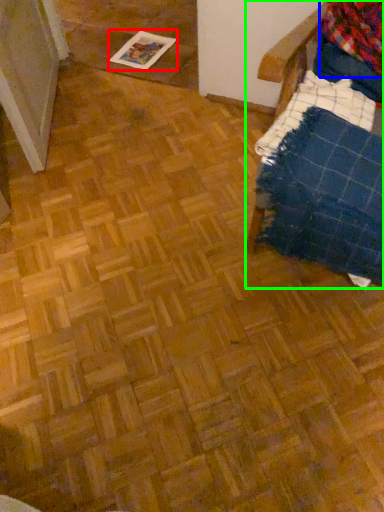
Question: Based on their relative distances, which object is nearer to magazine (highlighted by a red box)? Choose from flannel (highlighted by a blue box) and furniture (highlighted by a green box).

Choices:
 (A) flannel
 (B) furniture

Answer: (A)